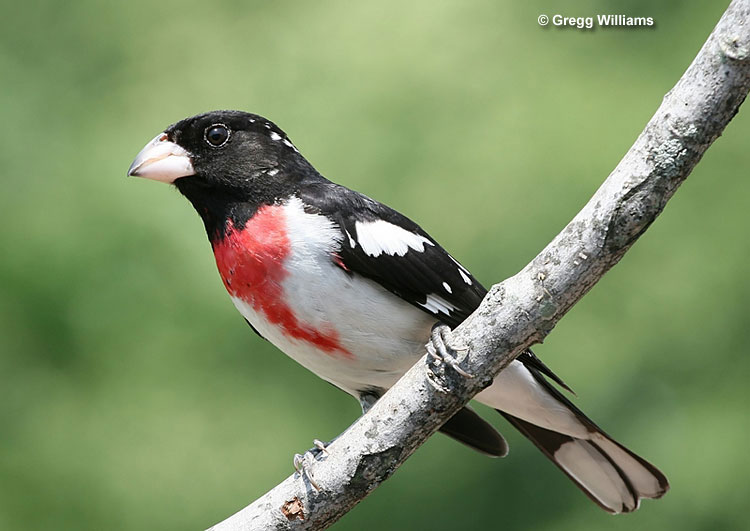
The image size is (750, 531). What are the coordinates of `red chest` in the screenshot? It's located at (241, 266).